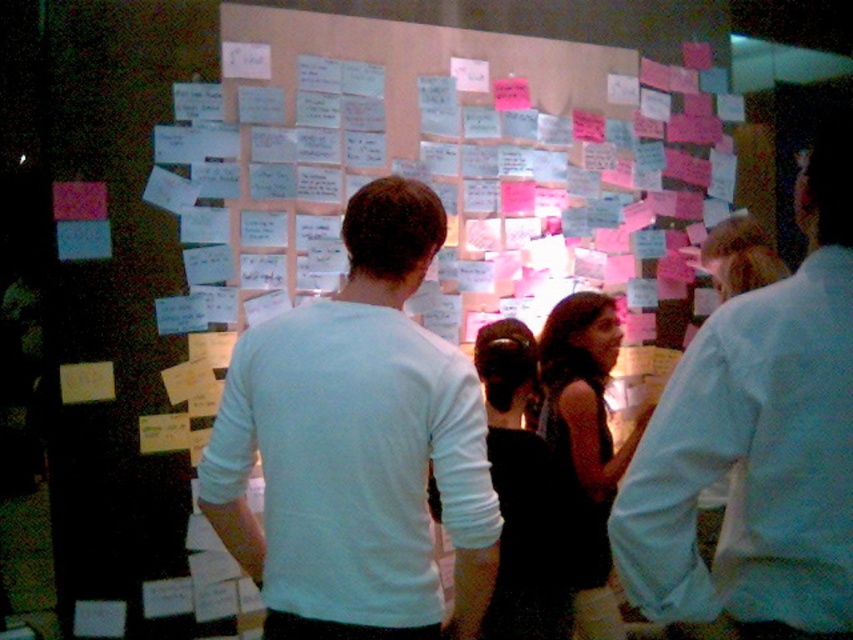
Is white matte shirt at upper right above black satin dress at center?

Indeed, white matte shirt at upper right is positioned over black satin dress at center.

Which of these two, white matte shirt at upper right or black satin dress at center, stands taller?

black satin dress at center is taller.

Which is behind, point (808, 596) or point (560, 611)?

Point (560, 611)

In order to click on white matte shirt at upper right in this screenshot , I will do `click(757, 445)`.

Is white matte shirt at center below black satin dress at center?

No.

Who is more distant from viewer, [437,406] or [531,588]?

The point [531,588] is behind.

You are a GUI agent. You are given a task and a screenshot of the screen. Output one action in this format:
    pyautogui.click(x=<x>, y=<y>)
    Task: Click on the white matte shirt at center
    This screenshot has width=853, height=640.
    Given the screenshot: What is the action you would take?
    pyautogui.click(x=357, y=445)

Is white matte shirt at upper right to the right of dark brown textured dress at center from the viewer's perspective?

Indeed, white matte shirt at upper right is positioned on the right side of dark brown textured dress at center.

Is white matte shirt at upper right bigger than dark brown textured dress at center?

No, white matte shirt at upper right is not bigger than dark brown textured dress at center.

This screenshot has height=640, width=853. In order to click on white matte shirt at upper right in this screenshot , I will do `click(757, 445)`.